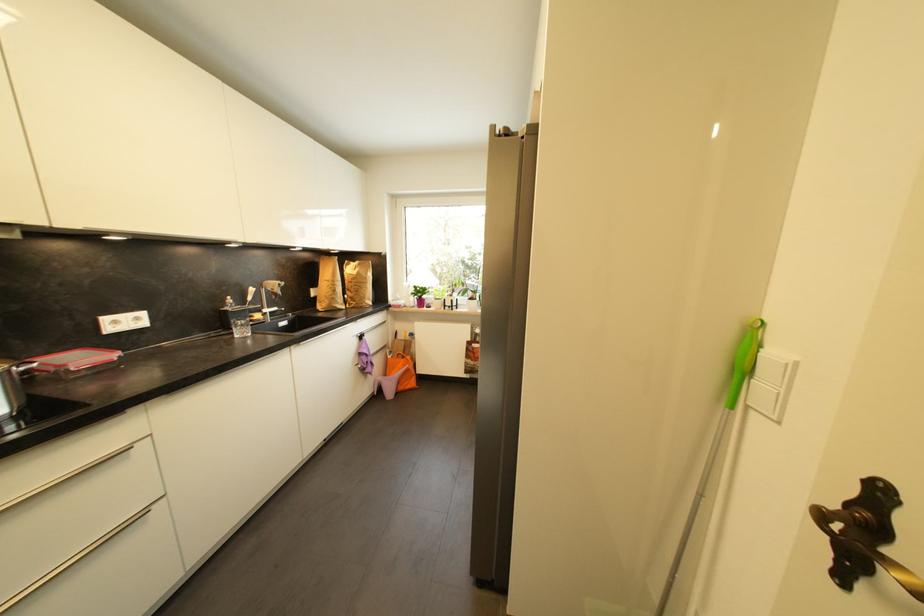
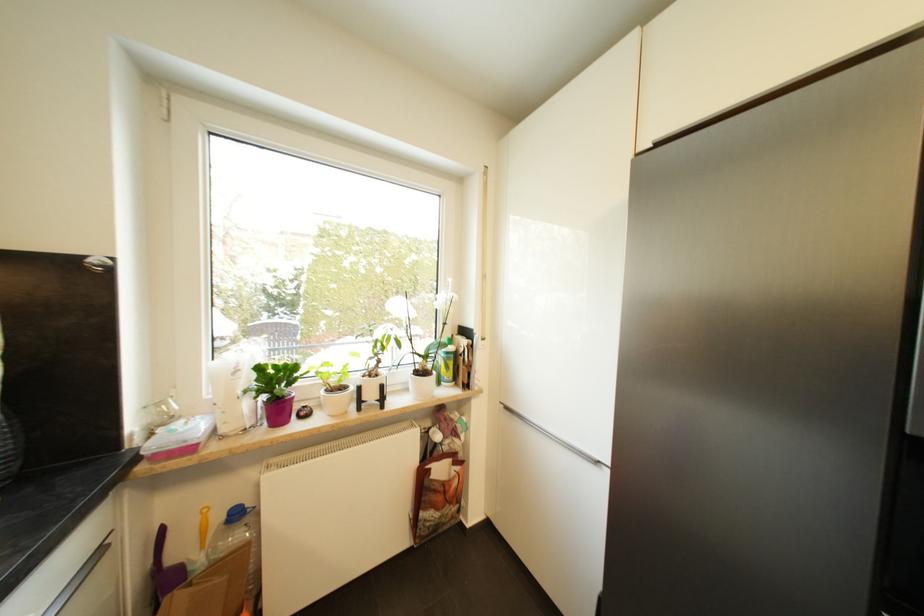
Locate, in the second image, the point that corresponds to [390,323] in the first image.

(105, 553)